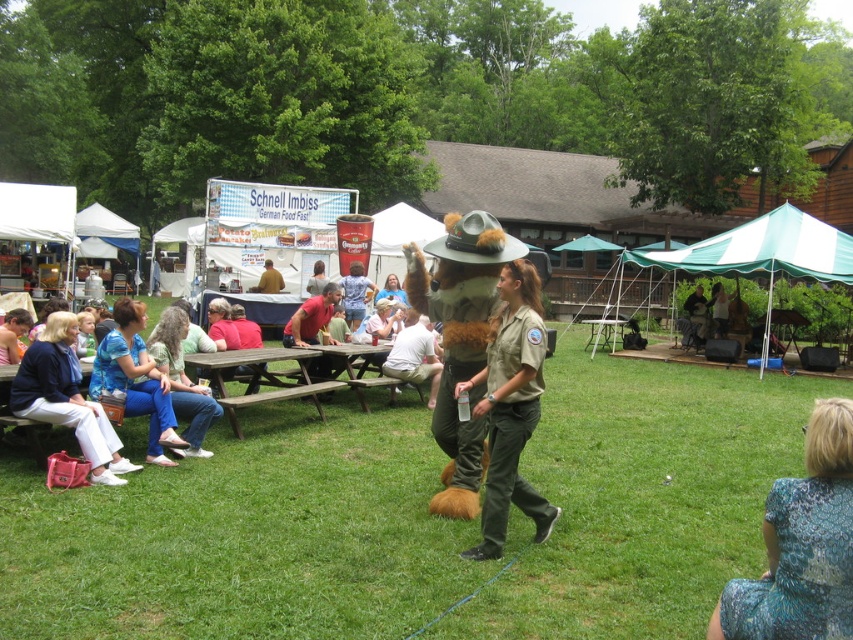
Who is positioned more to the right, red cotton shirt at center or matte blue shirt at lower left?

red cotton shirt at center

Which of these two, red cotton shirt at center or matte blue shirt at lower left, stands taller?

Standing taller between the two is red cotton shirt at center.

Is point (316, 369) more distant than point (20, 316)?

Yes, point (316, 369) is farther from viewer.

What are the coordinates of `red cotton shirt at center` in the screenshot? It's located at (311, 317).

Is green fabric canopy at upper right further to camera compared to brown leather jacket at center?

No, it is not.

Is green fabric canopy at upper right above brown leather jacket at center?

Yes.

Find the location of a particular element. The height and width of the screenshot is (640, 853). green fabric canopy at upper right is located at coordinates (763, 250).

Identify the location of green grass at center. The image size is (853, 640). (247, 536).

Between green grass at center and matte green uniform at center, which one has less height?

matte green uniform at center is shorter.

Does point (531, 625) come closer to viewer compared to point (403, 294)?

Yes, it is in front of point (403, 294).

At what (x,y) coordinates should I click in order to perform the action: click on green grass at center. Please return your answer as a coordinate pair (x, y). Looking at the image, I should click on (247, 536).